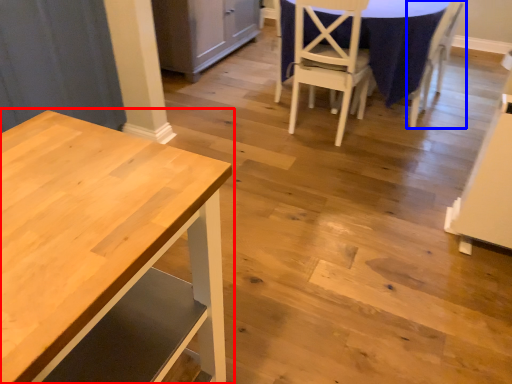
Question: Which point is further to the camera, table (highlighted by a red box) or chair (highlighted by a blue box)?

Choices:
 (A) table
 (B) chair

Answer: (B)